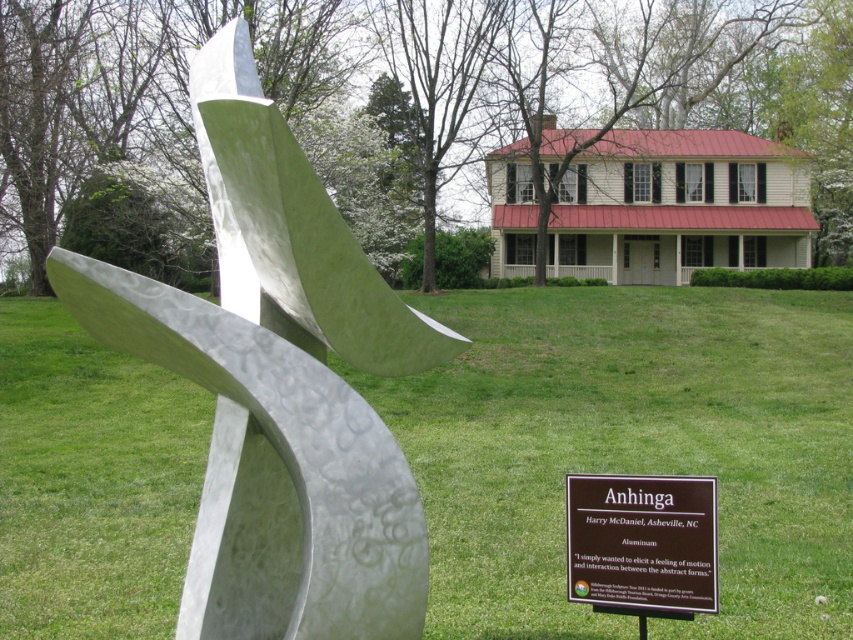
Question: Is green grass at lower center behind polished aluminum sculpture at center?

Choices:
 (A) no
 (B) yes

Answer: (B)

Question: Is the position of green grass at lower center less distant than that of polished aluminum sculpture at center?

Choices:
 (A) yes
 (B) no

Answer: (B)

Question: Which object is farther from the camera taking this photo?

Choices:
 (A) brown aluminum sign at center
 (B) green grass at lower center

Answer: (B)

Question: Among these points, which one is nearest to the camera?

Choices:
 (A) (550, 381)
 (B) (397, 636)
 (C) (669, 573)

Answer: (B)

Question: Which object is the closest to the brown aluminum sign at center?

Choices:
 (A) green grass at lower center
 (B) polished aluminum sculpture at center

Answer: (B)

Question: Is green grass at lower center positioned before brown aluminum sign at center?

Choices:
 (A) yes
 (B) no

Answer: (B)